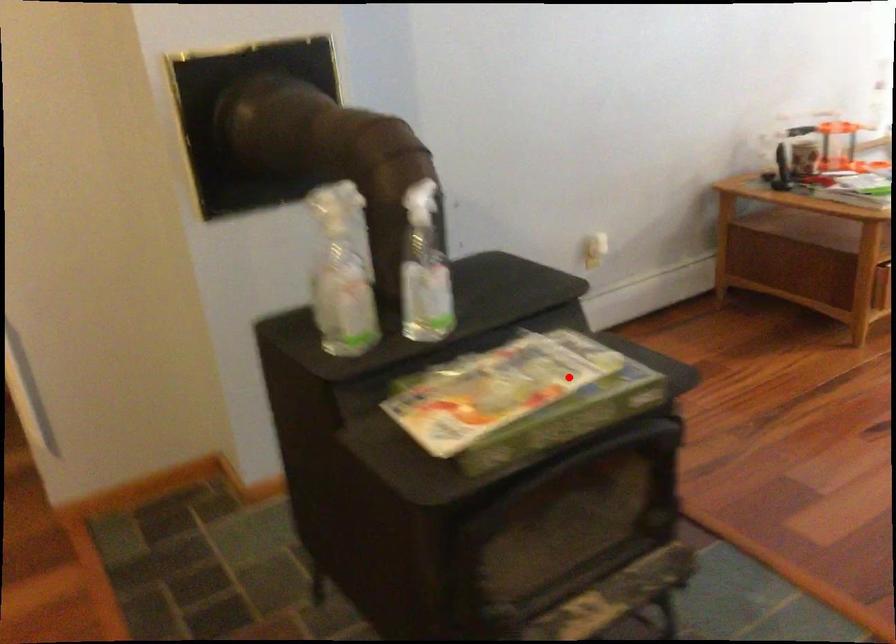
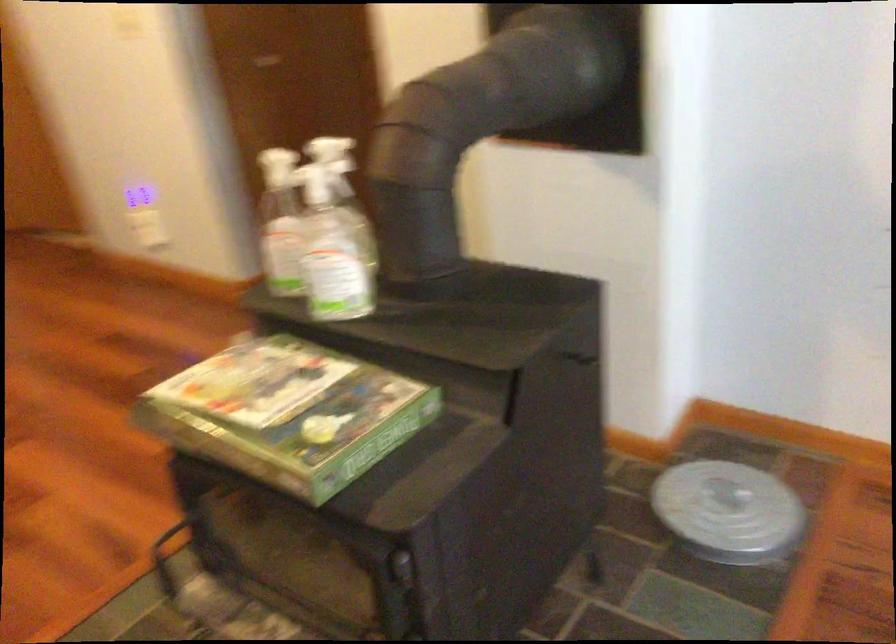
Locate, in the second image, the point that corresponds to the highlighted location in the first image.

(289, 413)